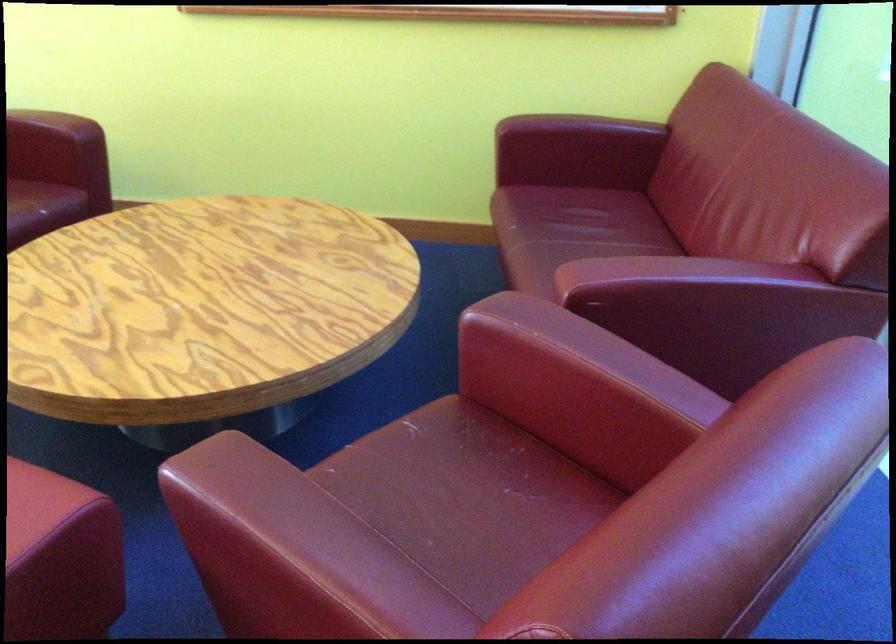
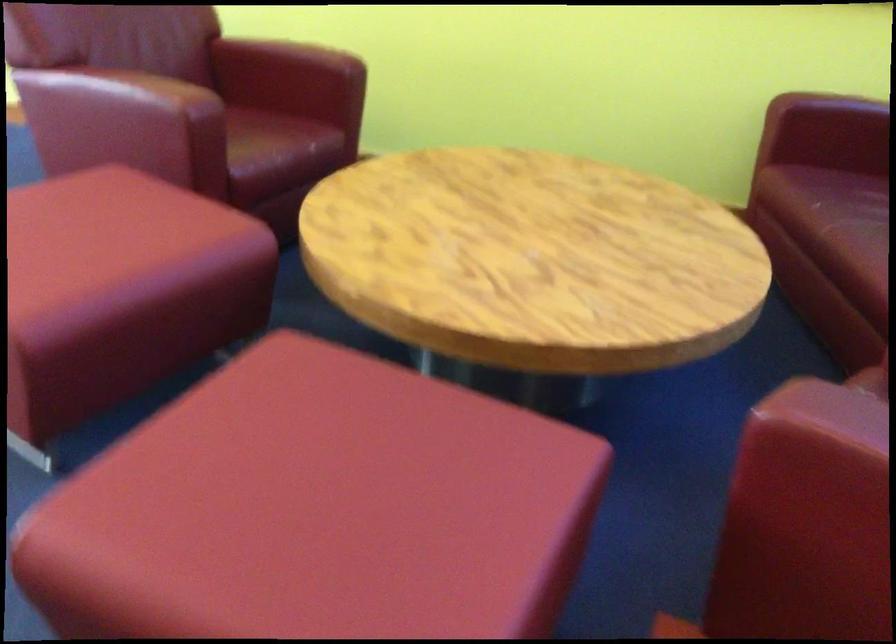
Question: Which direction would the cameraman need to move to produce the second image? Reply with the corresponding letter.

Choices:
 (A) Left
 (B) Right
 (C) Forward
 (D) Backward

Answer: (A)